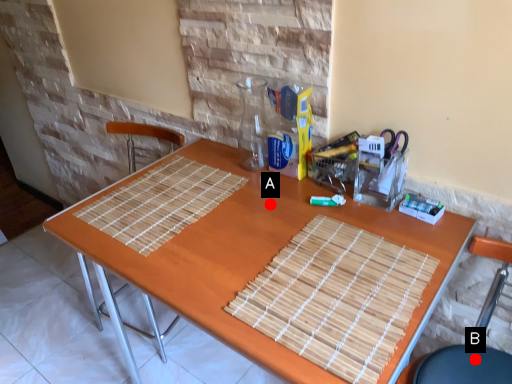
Question: Two points are circled on the image, labeled by A and B beside each circle. Which point is closer to the camera?

Choices:
 (A) A is closer
 (B) B is closer

Answer: (B)